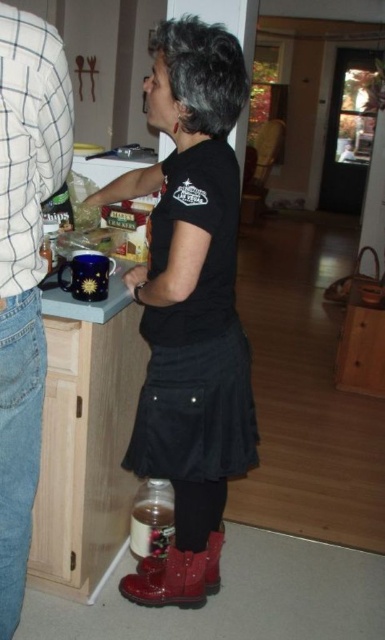
You are a delivery person who needs to place a small package between the shiny patent leather boots at lower center and the denim jeans at left. Based on the scene, can you fit the package between them?

The shiny patent leather boots at lower center is positioned on the right side of denim jeans at left, so there is space between them to place the small package.

You are standing in the kitchen and want to reach the shiny patent leather boots at lower center located at point (190, 307). The counter has a blue mug with a sun design and a box of crackers. Which object is closer to the boots?

The shiny patent leather boots at lower center are at point (190, 307). The blue mug with a sun design is closer to the boots than the box of crackers.

You are a delivery person who needs to place a small package between the shiny patent leather boots at lower center and the denim jeans at left. Can you fit the package there?

The shiny patent leather boots at lower center are wider than the denim jeans at left, so the space between them may be limited. However, since the package is small, it might fit depending on the exact dimensions.